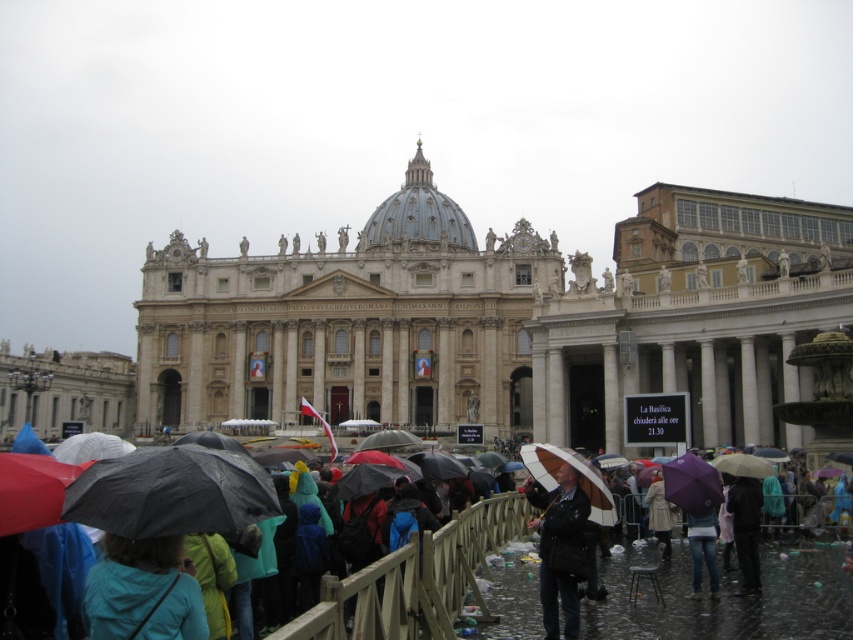
You are standing at point (540, 500) and want to walk to the entrance of St. Peter Basilica. There is a point (358, 595) in your path. Is this point in front of or behind you relative to your destination?

Point (358, 595) is in front of point (540, 500), so it is in front of you relative to your destination.